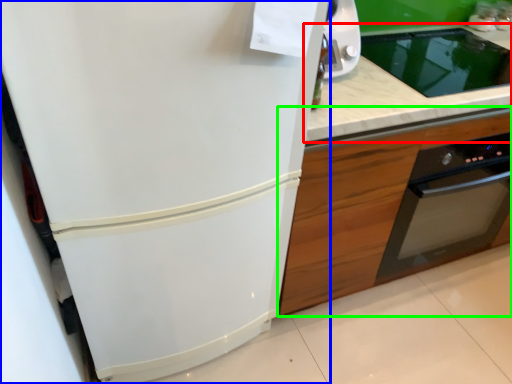
Question: Which object is the farthest from countertop (highlighted by a red box)? Choose among these: refrigerator (highlighted by a blue box) or cabinetry (highlighted by a green box).

Choices:
 (A) refrigerator
 (B) cabinetry

Answer: (A)